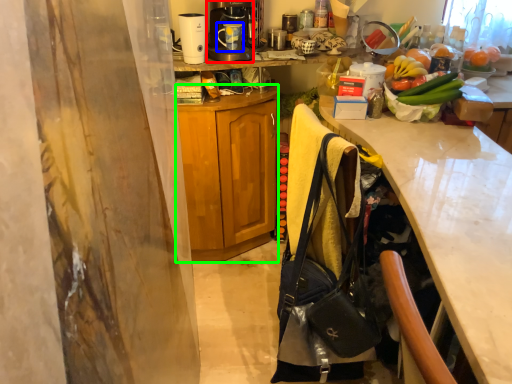
Question: Which is nearer to the coffee maker (highlighted by a red box)? coffee cup (highlighted by a blue box) or cabinetry (highlighted by a green box).

Choices:
 (A) coffee cup
 (B) cabinetry

Answer: (A)